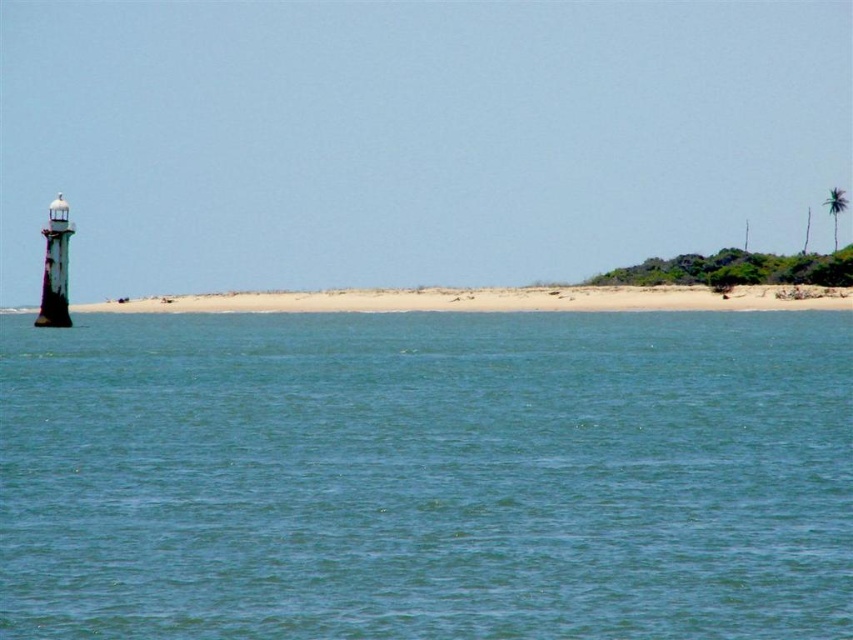
You are a bird flying over the coastal area and want to land on the blue water at center or the beige sand beach at center. Which surface will you choose if you prefer a higher elevation?

The blue water at center has a greater height compared to the beige sand beach at center, so you should choose the blue water at center for a higher elevation landing spot.

You are planning to build a small cabin on the beige sand beach at center. Considering the proximity to the blue water at center, how does the width of the beach compare to the water to ensure the cabin stays dry during high tide?

The beige sand beach at center is wider than the blue water at center. Since the beach is wider, building the cabin on the beige sand beach at center would provide more space away from the water, reducing the risk of flooding during high tide.